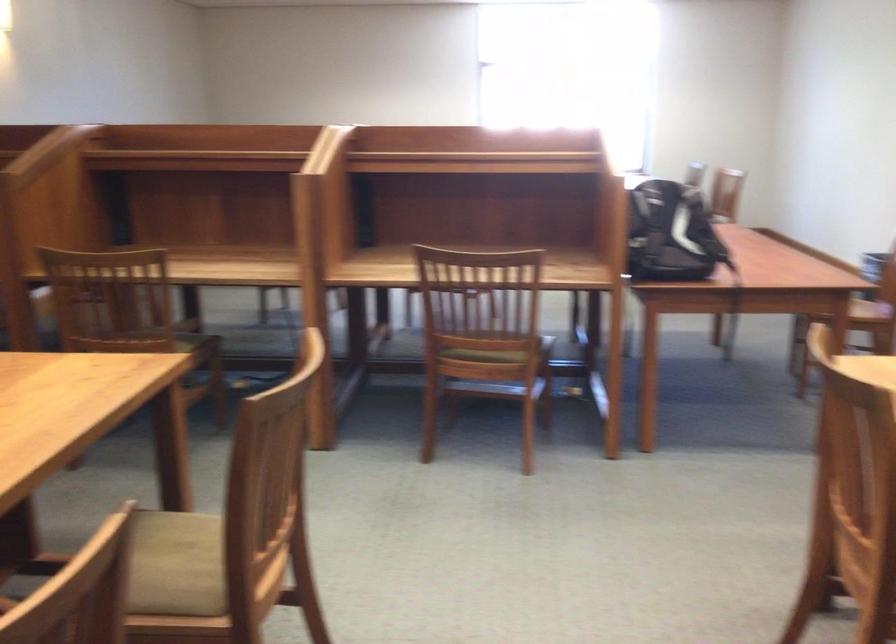
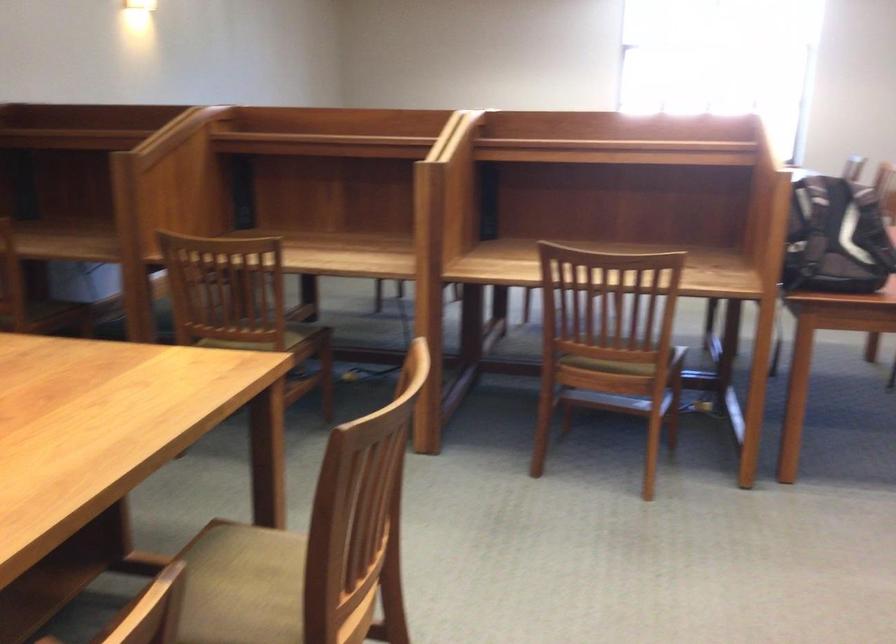
Question: What movement of the cameraman would produce the second image?

Choices:
 (A) Left
 (B) Right
 (C) Forward
 (D) Backward

Answer: (C)